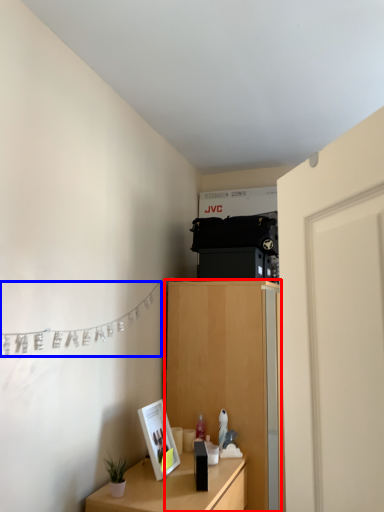
Question: Which of the following is the closest to the observer, cabinetry (highlighted by a red box) or clothesline (highlighted by a blue box)?

Choices:
 (A) cabinetry
 (B) clothesline

Answer: (B)